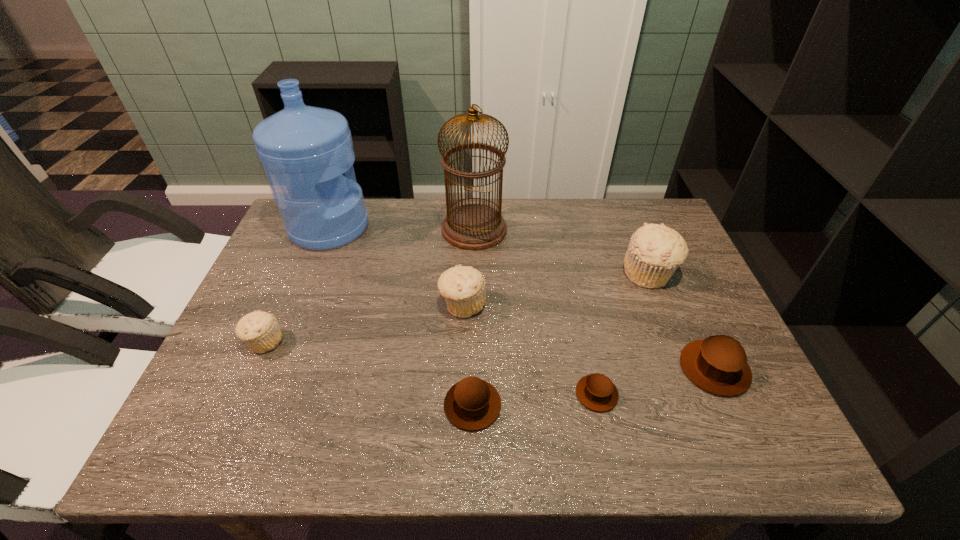
The image size is (960, 540). Identify the location of the seventh tallest object. (472, 404).

What are the coordinates of `the fourth muffin from left to right` in the screenshot? It's located at (597, 392).

Where is `the smallest brown muffin`? The width and height of the screenshot is (960, 540). the smallest brown muffin is located at coordinates (597, 392).

In order to click on vacant region located 0.080m on the side of the blue water jug with the handle in this screenshot , I will do `click(395, 227)`.

Identify the location of vacant space located on the front-facing side of the birdcage. (533, 230).

In order to click on vacant area situated on the back of the biggest beige muffin in this screenshot , I will do `click(626, 216)`.

Image resolution: width=960 pixels, height=540 pixels. I want to click on free space located 0.100m on the front of the fifth shortest object, so click(461, 356).

In order to click on free spot located 0.100m on the right of the leftmost muffin in this screenshot , I will do `click(325, 342)`.

Where is `vacant space situated 0.250m on the back of the rightmost brown muffin`? The image size is (960, 540). vacant space situated 0.250m on the back of the rightmost brown muffin is located at coordinates (669, 269).

Where is `free spot located 0.180m on the left of the seventh tallest object`? Image resolution: width=960 pixels, height=540 pixels. free spot located 0.180m on the left of the seventh tallest object is located at coordinates coord(358,405).